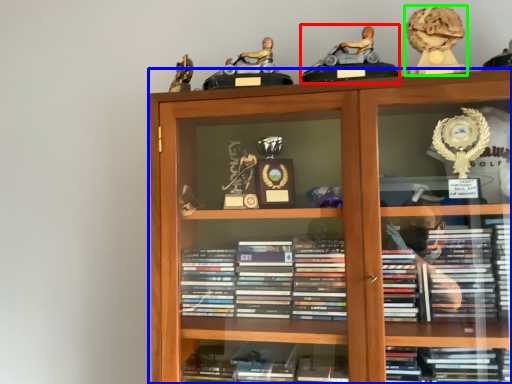
Question: Based on their relative distances, which object is nearer to toy (highlighted by a red box)? Choose from bookcase (highlighted by a blue box) and toy (highlighted by a green box).

Choices:
 (A) bookcase
 (B) toy

Answer: (B)